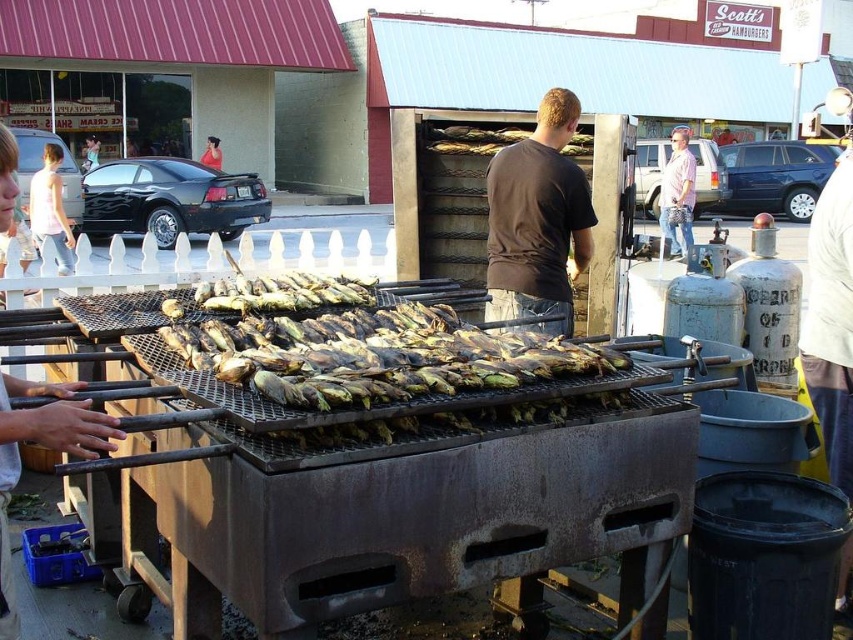
Question: Does charred corn at center appear on the right side of pink fabric dress at left?

Choices:
 (A) no
 (B) yes

Answer: (B)

Question: Does charred corn at center have a greater width compared to dark brown shirt at center?

Choices:
 (A) no
 (B) yes

Answer: (B)

Question: Which point is farther to the camera?

Choices:
 (A) (682, 131)
 (B) (494, 172)
 (C) (49, 166)
 (D) (381, 320)

Answer: (A)

Question: Among these objects, which one is nearest to the camera?

Choices:
 (A) dark brown shirt at center
 (B) charred corn at center

Answer: (B)

Question: Estimate the real-world distances between objects in this image. Which object is closer to the pink fabric dress at left?

Choices:
 (A) charred corn at center
 (B) pink cotton shirt at center

Answer: (A)

Question: Is pink fabric dress at left further to the viewer compared to pink cotton shirt at center?

Choices:
 (A) no
 (B) yes

Answer: (A)